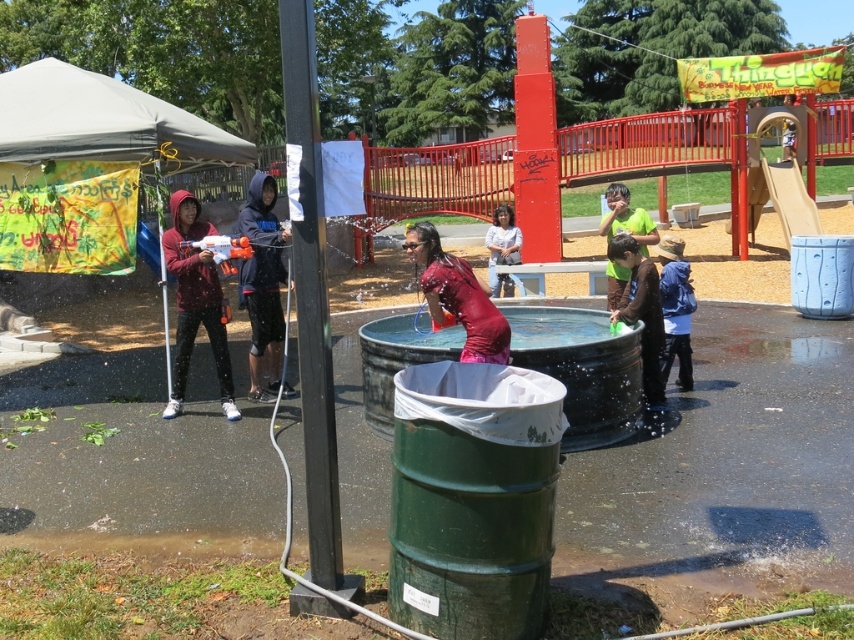
Is dark blue hoodie at center taller than green fabric shirt at lower right?

Correct, dark blue hoodie at center is much taller as green fabric shirt at lower right.

Can you confirm if dark blue hoodie at center is positioned below green fabric shirt at lower right?

No.

I want to click on dark blue hoodie at center, so click(262, 282).

Can you confirm if shiny red dress at center is positioned above green matte shirt at center?

Actually, shiny red dress at center is below green matte shirt at center.

Does shiny red dress at center have a greater height compared to green matte shirt at center?

In fact, shiny red dress at center may be shorter than green matte shirt at center.

Is point (478, 344) closer to camera compared to point (611, 291)?

Yes, it is in front of point (611, 291).

Find the location of a particular element. Image resolution: width=854 pixels, height=640 pixels. shiny red dress at center is located at coordinates (458, 296).

Is green fabric shirt at lower right behind matte pink shirt at center?

No, green fabric shirt at lower right is in front of matte pink shirt at center.

Does green fabric shirt at lower right have a lesser width compared to matte pink shirt at center?

No, green fabric shirt at lower right is not thinner than matte pink shirt at center.

This screenshot has width=854, height=640. What do you see at coordinates (641, 314) in the screenshot?
I see `green fabric shirt at lower right` at bounding box center [641, 314].

Where is `green fabric shirt at lower right`? The image size is (854, 640). green fabric shirt at lower right is located at coordinates (641, 314).